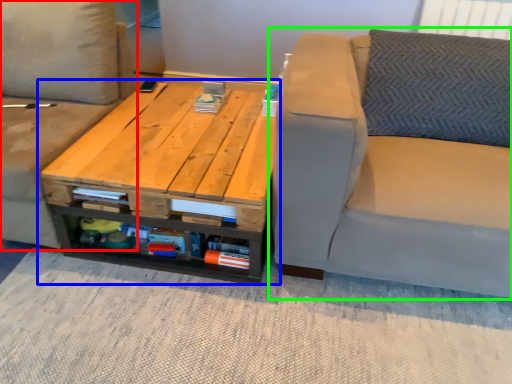
Question: Which object is the farthest from studio couch (highlighted by a red box)? Choose among these: table (highlighted by a blue box) or studio couch (highlighted by a green box).

Choices:
 (A) table
 (B) studio couch

Answer: (B)